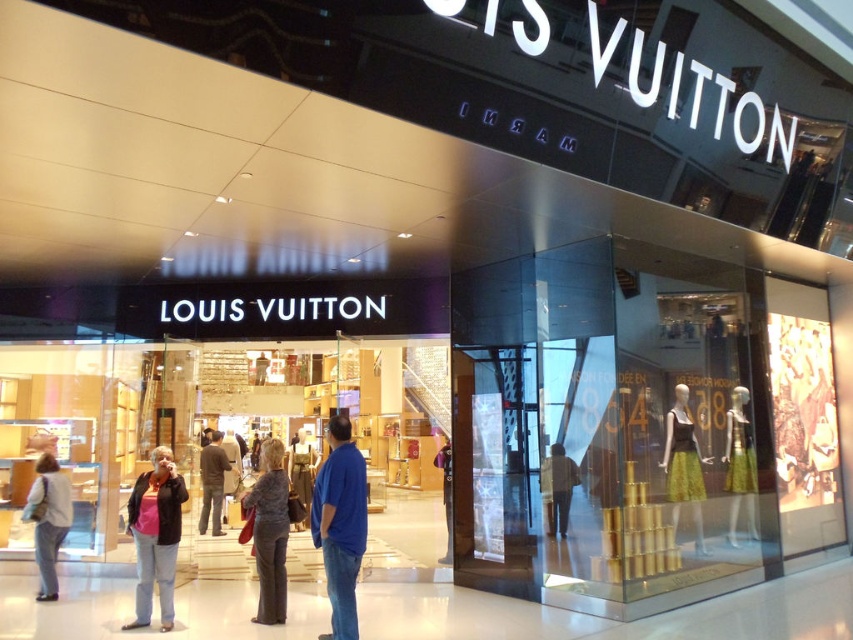
Is denim jacket at lower left bigger than dark gray fabric coat at center?

Correct, denim jacket at lower left is larger in size than dark gray fabric coat at center.

Looking at this image, is denim jacket at lower left thinner than dark gray fabric coat at center?

In fact, denim jacket at lower left might be wider than dark gray fabric coat at center.

What do you see at coordinates (155, 536) in the screenshot? This screenshot has height=640, width=853. I see `denim jacket at lower left` at bounding box center [155, 536].

What are the coordinates of `denim jacket at lower left` in the screenshot? It's located at (155, 536).

Who is positioned more to the left, light gray jeans at lower left or dark brown leather jacket at center?

From the viewer's perspective, light gray jeans at lower left appears more on the left side.

Between light gray jeans at lower left and dark brown leather jacket at center, which one appears on the right side from the viewer's perspective?

From the viewer's perspective, dark brown leather jacket at center appears more on the right side.

Image resolution: width=853 pixels, height=640 pixels. I want to click on light gray jeans at lower left, so pyautogui.click(x=48, y=520).

Between denim jacket at lower left and light gray jeans at lower left, which one is positioned lower?

light gray jeans at lower left

Between denim jacket at lower left and light gray jeans at lower left, which one has more height?

→ Standing taller between the two is denim jacket at lower left.

Does point (154, 534) come farther from viewer compared to point (35, 516)?

No, it is in front of (35, 516).

Where is `denim jacket at lower left`? The width and height of the screenshot is (853, 640). denim jacket at lower left is located at coordinates (155, 536).